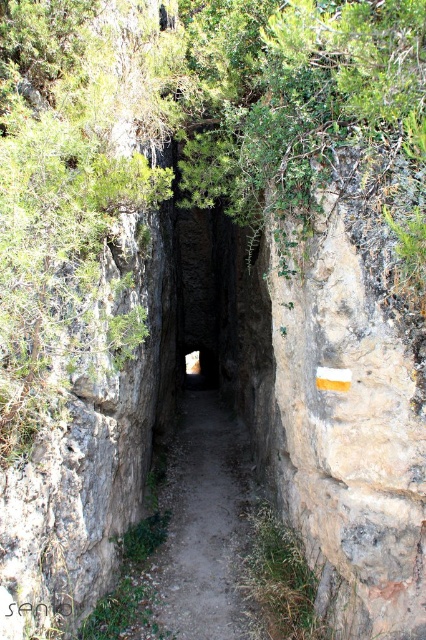
Question: Which point is farther to the camera?

Choices:
 (A) (330, 12)
 (B) (213, 588)

Answer: (B)

Question: Is green leafy tree at upper center below dirt path at center?

Choices:
 (A) yes
 (B) no

Answer: (B)

Question: Can you confirm if green leafy tree at upper center is positioned to the left of dirt path at center?

Choices:
 (A) no
 (B) yes

Answer: (A)

Question: Which object appears farthest from the camera in this image?

Choices:
 (A) green leafy tree at upper center
 (B) dirt path at center

Answer: (B)

Question: Which point appears closest to the camera in this image?

Choices:
 (A) (175, 436)
 (B) (319, 90)

Answer: (B)

Question: Is green leafy tree at upper center thinner than dirt path at center?

Choices:
 (A) no
 (B) yes

Answer: (A)